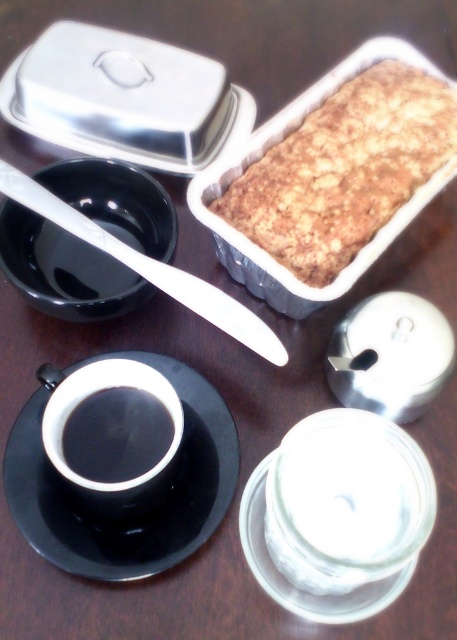
Is white plastic knife at upper left taller than black glossy cup at center?

Indeed, white plastic knife at upper left has a greater height compared to black glossy cup at center.

Which is behind, point (175, 268) or point (74, 449)?

The point (175, 268) is more distant.

Identify the location of white plastic knife at upper left. The image size is (457, 640). (148, 268).

What do you see at coordinates (148, 518) in the screenshot? I see `black ceramic saucer at center` at bounding box center [148, 518].

Does black ceramic saucer at center appear on the left side of black glossy cup at center?

Indeed, black ceramic saucer at center is positioned on the left side of black glossy cup at center.

Find the location of `black ceramic saucer at center`. black ceramic saucer at center is located at coordinates (148, 518).

Find the location of a particular element. black ceramic saucer at center is located at coordinates (148, 518).

Who is more distant from viewer, (x=36, y=451) or (x=21, y=60)?

Positioned behind is point (x=21, y=60).

Does black ceramic saucer at center appear over brushed metal container at upper left?

No.

Does point (26, 451) come closer to viewer compared to point (239, 141)?

Yes, it is.

Where is `black ceramic saucer at center`? black ceramic saucer at center is located at coordinates (148, 518).